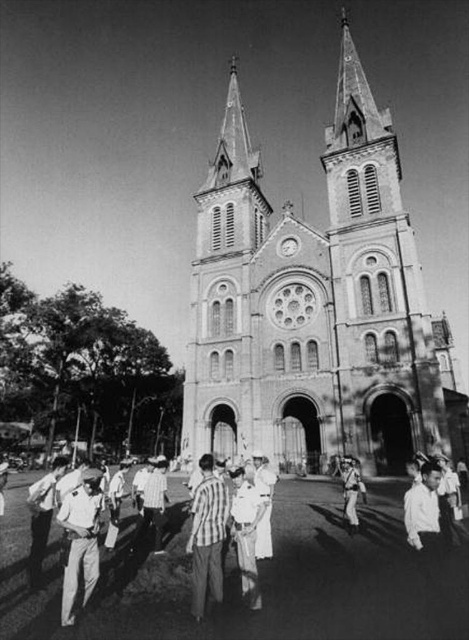
Can you confirm if checkered fabric shirt at center is positioned below light brown leather jacket at lower left?

No.

Between point (193, 589) and point (44, 483), which one is positioned in front?

Point (193, 589) is more forward.

At what (x,y) coordinates should I click in order to perform the action: click on checkered fabric shirt at center. Please return your answer as a coordinate pair (x, y). The image size is (469, 640). Looking at the image, I should click on (207, 536).

Between point (240, 148) and point (39, 572), which one is positioned in front?

Point (39, 572) is in front.

Does stone church at center appear on the left side of light brown leather jacket at lower left?

In fact, stone church at center is to the right of light brown leather jacket at lower left.

What do you see at coordinates (317, 307) in the screenshot?
I see `stone church at center` at bounding box center [317, 307].

Where is `stone church at center`? The height and width of the screenshot is (640, 469). stone church at center is located at coordinates (317, 307).

Is stone church at center above checkered fabric shirt at center?

Yes.

Can you confirm if stone church at center is thinner than checkered fabric shirt at center?

Incorrect, stone church at center's width is not less than checkered fabric shirt at center's.

The image size is (469, 640). Find the location of `stone church at center`. stone church at center is located at coordinates (317, 307).